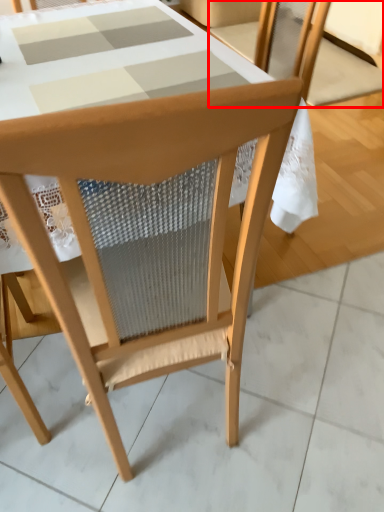
Question: From the image's perspective, what is the correct spatial relationship of chair (annotated by the red box) in relation to chair?

Choices:
 (A) above
 (B) below

Answer: (A)